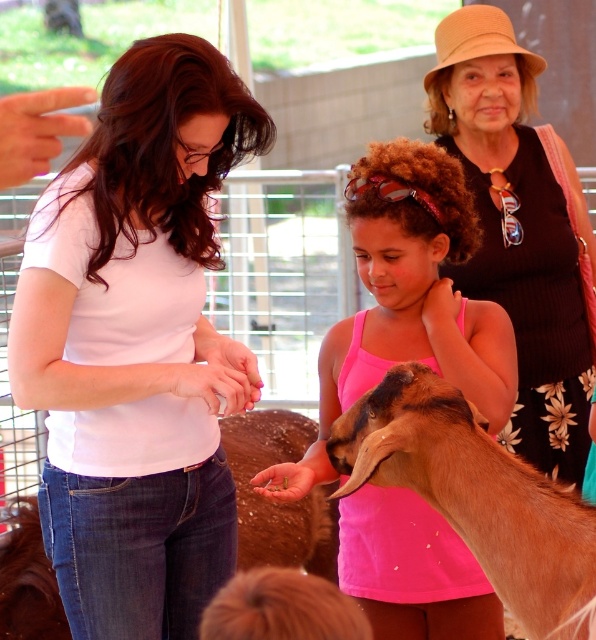
You are a photographer trying to capture a candid shot of the two people in the scene. You notice the white matte shirt at center and the pink fabric tank top at center. Which person should you focus on first if you want to photograph them both in the same frame without moving your camera?

You should focus on the white matte shirt at center first because it is positioned on the left side of the pink fabric tank top at center, so capturing the left side first will ensure both are in frame.

You are designing a poster for the petting zoo and need to ensure the black ribbed tank top at upper right and the brown fuzzy goat at center are placed appropriately. Given their sizes, which object should be positioned further back to maintain visual balance?

The black ribbed tank top at upper right should be positioned further back because its width is larger than the brown fuzzy goat at center, so placing it further back helps balance the visual weight.

You are a photographer trying to capture a clear shot of the brown fuzzy goat at center and the black ribbed tank top at upper right. Based on their positions, which object is closer to the camera?

The black ribbed tank top at upper right is closer to the camera because the brown fuzzy goat at center is positioned behind it.